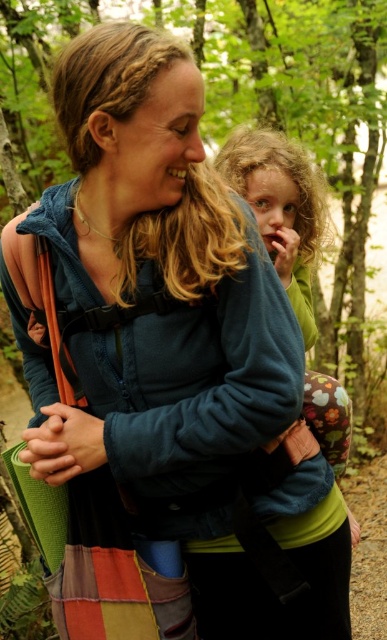
Question: Is fluffy green sweater at center positioned at the back of curly blonde hair at upper center?

Choices:
 (A) yes
 (B) no

Answer: (B)

Question: Which of the following is the closest to the observer?

Choices:
 (A) curly blonde hair at upper center
 (B) fluffy green sweater at center

Answer: (B)

Question: Does fluffy green sweater at center appear under curly blonde hair at upper center?

Choices:
 (A) no
 (B) yes

Answer: (B)

Question: Observing the image, what is the correct spatial positioning of fluffy green sweater at center in reference to curly blonde hair at upper center?

Choices:
 (A) left
 (B) right

Answer: (B)